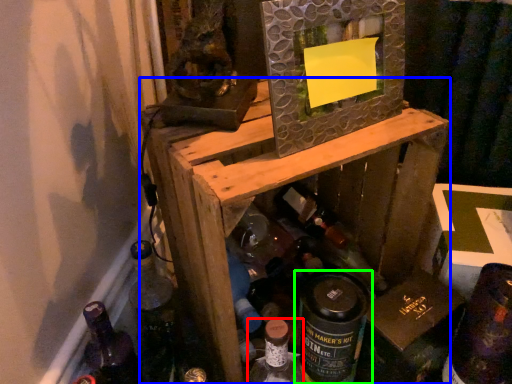
Question: Considering the real-world distances, which object is closest to bottle (highlighted by a red box)? furniture (highlighted by a blue box) or bottle (highlighted by a green box).

Choices:
 (A) furniture
 (B) bottle

Answer: (B)